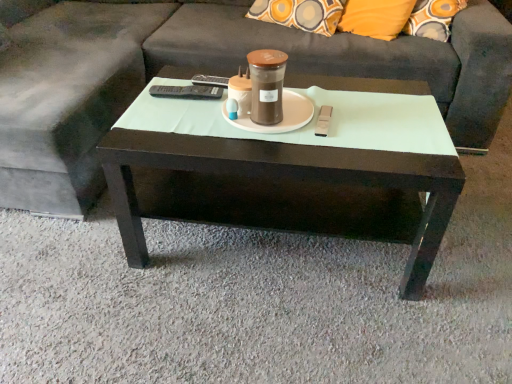
Question: Is dark wood coffee table at center wider or thinner than dark gray fabric couch at center?

Choices:
 (A) thin
 (B) wide

Answer: (A)

Question: Considering the positions of dark wood coffee table at center and dark gray fabric couch at center in the image, is dark wood coffee table at center taller or shorter than dark gray fabric couch at center?

Choices:
 (A) short
 (B) tall

Answer: (A)

Question: Based on their relative distances, which object is nearer to the dark gray fabric couch at center?

Choices:
 (A) brown matte jar at center
 (B) dark wood coffee table at center
 (C) white matte saucer at center

Answer: (B)

Question: Based on their relative distances, which object is farther from the dark gray fabric couch at center?

Choices:
 (A) brown matte jar at center
 (B) dark wood coffee table at center
 (C) white matte saucer at center

Answer: (A)